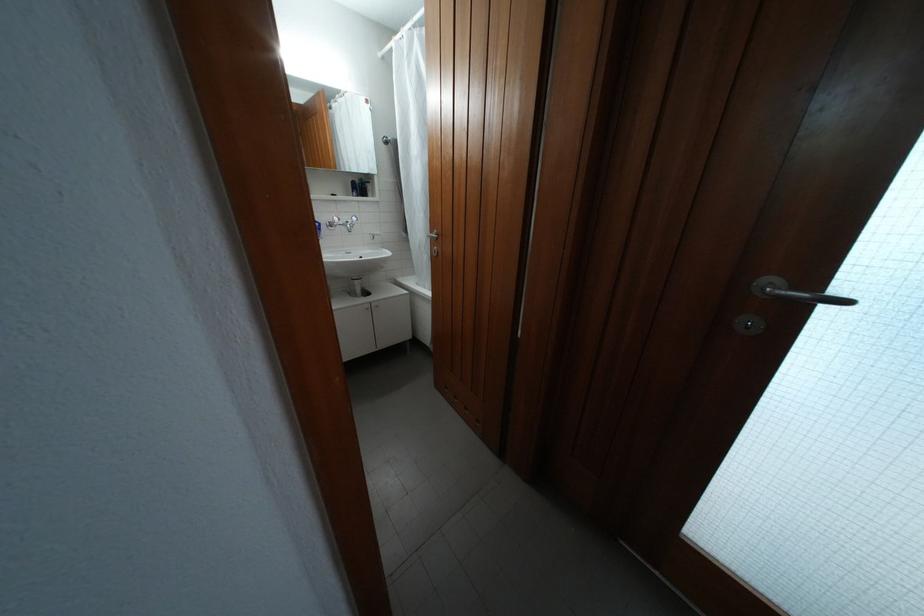
Find where to turn the faucet handle. Please return your answer as a coordinate pair (x, y).

(353, 223)